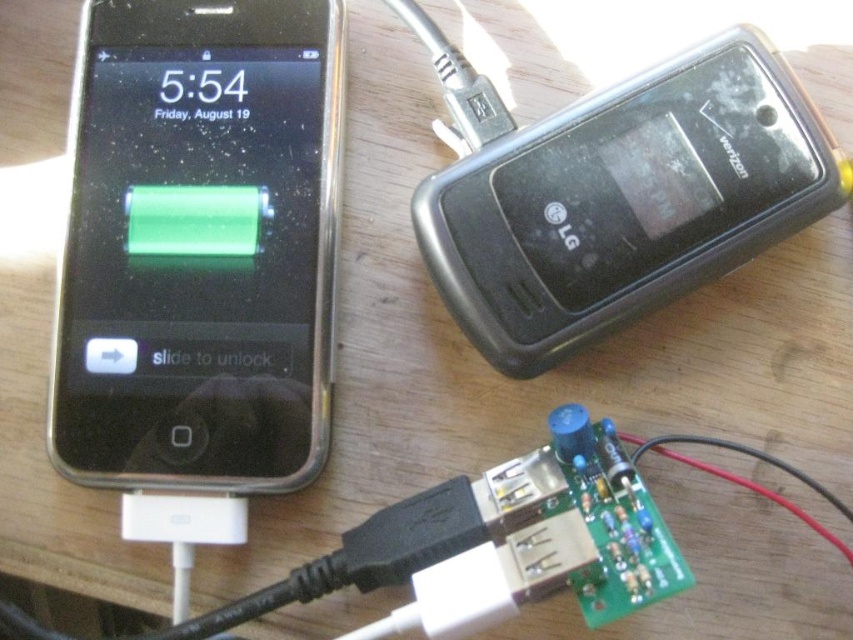
You are a delivery person who needs to place a small package between the black glossy smartphone at left and the black plastic lg phone at upper right. The package measures 12 inches in length. Can you fit it between them without moving either device?

The distance between the black glossy smartphone at left and the black plastic lg phone at upper right is 14.51 inches. Since the package is 12 inches long, it can fit between them as there is enough space.

You are trying to unplug the charging cables from both the black glossy smartphone at left and the black plastic lg phone at upper right. Which device should you unplug first if you want to start with the one that is closer to you?

You should unplug the black glossy smartphone at left first because the black plastic lg phone at upper right is behind it, meaning the black glossy smartphone at left is closer to you.

You are trying to choose between the black glossy smartphone at left and the black plastic lg phone at upper right based on their sizes. Which one is smaller?

The black glossy smartphone at left is smaller than the black plastic lg phone at upper right.